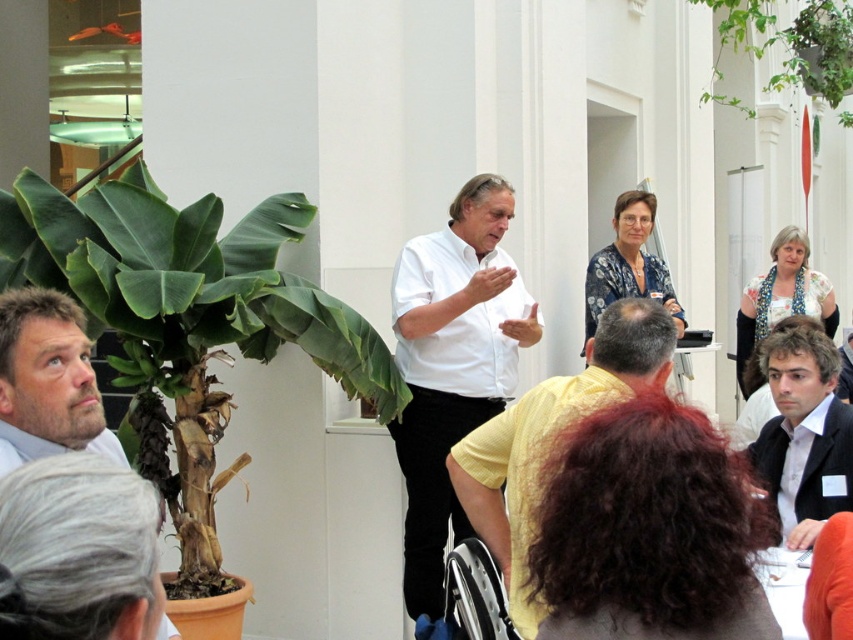
Question: Observing the image, what is the correct spatial positioning of green leafy plant at left in reference to yellow matte shirt at center?

Choices:
 (A) below
 (B) above

Answer: (B)

Question: Which of these objects is positioned closest to the light blue shirt at lower left?

Choices:
 (A) yellow matte shirt at center
 (B) dark blue suit at center
 (C) white matte shirt at center
 (D) matte white shirt at lower left

Answer: (D)

Question: Is light blue shirt at lower left thinner than matte white shirt at lower left?

Choices:
 (A) no
 (B) yes

Answer: (B)

Question: Which of the following is the closest to the observer?

Choices:
 (A) green leafy plant at upper right
 (B) yellow matte shirt at center
 (C) green leafy plant at left

Answer: (B)

Question: Does white matte shirt at center have a lesser width compared to dark blue suit at center?

Choices:
 (A) yes
 (B) no

Answer: (B)

Question: Among these objects, which one is farthest from the camera?

Choices:
 (A) yellow matte shirt at center
 (B) matte white shirt at lower left
 (C) green leafy plant at left

Answer: (C)